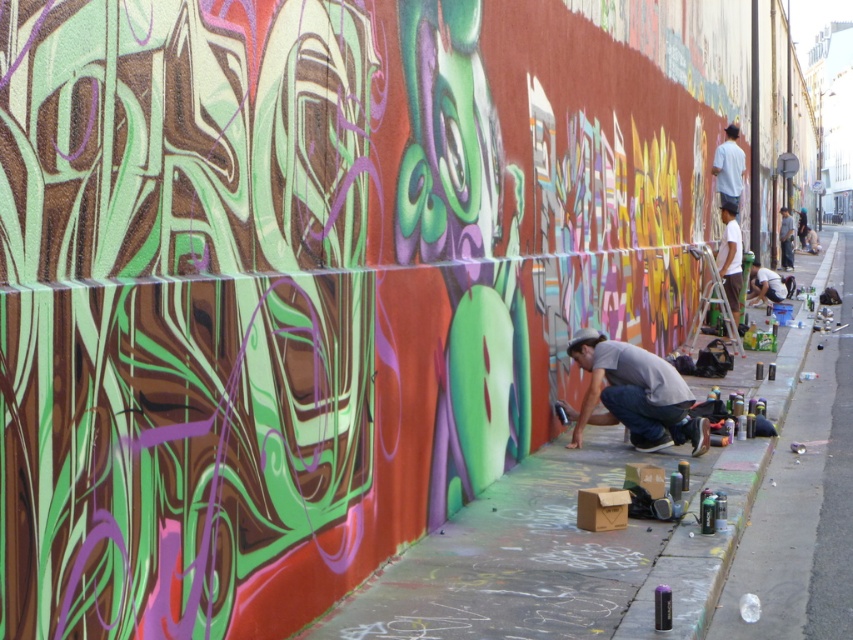
Is gray fabric squat at center to the left of dark gray shirt at lower right from the viewer's perspective?

Correct, you'll find gray fabric squat at center to the left of dark gray shirt at lower right.

Can you confirm if gray fabric squat at center is taller than dark gray shirt at lower right?

Incorrect, gray fabric squat at center's height is not larger of dark gray shirt at lower right's.

Between point (616, 342) and point (782, 211), which one is positioned in front?

Point (616, 342) is in front.

I want to click on gray fabric squat at center, so click(x=633, y=394).

Which is more to the left, concrete sidewalk at center or white matte shirt at upper right?

concrete sidewalk at center is more to the left.

Can you confirm if concrete sidewalk at center is thinner than white matte shirt at upper right?

No, concrete sidewalk at center is not thinner than white matte shirt at upper right.

The width and height of the screenshot is (853, 640). Identify the location of concrete sidewalk at center. (541, 556).

Locate an element on the screen. The width and height of the screenshot is (853, 640). concrete sidewalk at center is located at coordinates (541, 556).

Which is more to the right, white matte shirt at upper right or white cotton shirt at upper right?

Positioned to the right is white cotton shirt at upper right.

Is point (718, 260) less distant than point (732, 150)?

Yes, it is.

Is point (730, 248) farther from camera compared to point (737, 186)?

That is False.

This screenshot has height=640, width=853. Find the location of `white matte shirt at upper right`. white matte shirt at upper right is located at coordinates (730, 257).